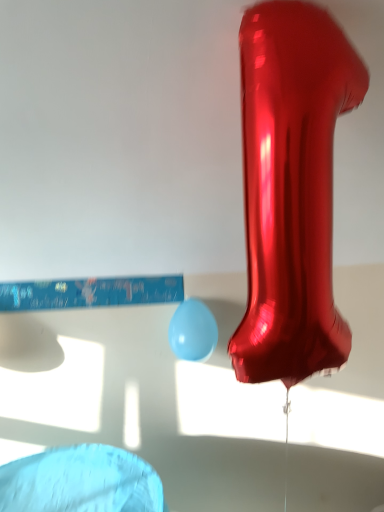
Question: Is shiny metallic number one at center touching light blue glossy balloon at center?

Choices:
 (A) yes
 (B) no

Answer: (B)

Question: From a real-world perspective, does shiny metallic number one at center sit lower than light blue glossy balloon at center?

Choices:
 (A) yes
 (B) no

Answer: (B)

Question: Is shiny metallic number one at center positioned far away from light blue glossy balloon at center?

Choices:
 (A) no
 (B) yes

Answer: (A)

Question: From a real-world perspective, is shiny metallic number one at center over light blue glossy balloon at center?

Choices:
 (A) no
 (B) yes

Answer: (B)

Question: Is shiny metallic number one at center surrounding light blue glossy balloon at center?

Choices:
 (A) yes
 (B) no

Answer: (B)

Question: Can you confirm if shiny metallic number one at center is thinner than light blue glossy balloon at center?

Choices:
 (A) no
 (B) yes

Answer: (A)

Question: Is shiny metallic number one at center completely or partially inside light blue glossy balloon at center?

Choices:
 (A) yes
 (B) no

Answer: (B)

Question: Is light blue glossy balloon at center taller than shiny metallic number one at center?

Choices:
 (A) no
 (B) yes

Answer: (A)

Question: Is the position of light blue glossy balloon at center more distant than that of shiny metallic number one at center?

Choices:
 (A) no
 (B) yes

Answer: (B)

Question: Could you tell me if light blue glossy balloon at center is facing shiny metallic number one at center?

Choices:
 (A) yes
 (B) no

Answer: (A)

Question: Considering the relative sizes of light blue glossy balloon at center and shiny metallic number one at center in the image provided, is light blue glossy balloon at center wider than shiny metallic number one at center?

Choices:
 (A) yes
 (B) no

Answer: (B)

Question: Is light blue glossy balloon at center in front of shiny metallic number one at center?

Choices:
 (A) yes
 (B) no

Answer: (B)

Question: From the image's perspective, is shiny metallic number one at center located above or below light blue glossy balloon at center?

Choices:
 (A) below
 (B) above

Answer: (B)